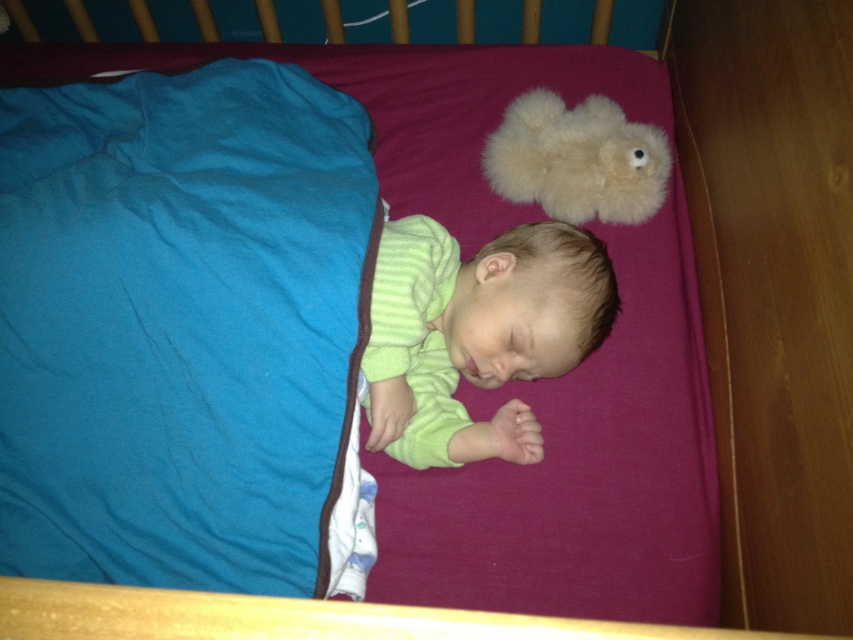
Based on the photo, you are a parent checking on your baby in the crib. You notice the teal soft fabric at lower left and the green soft baby at center. How far apart are these two items?

The teal soft fabric at lower left and the green soft baby at center are 8.13 inches apart from each other.

You are a parent checking on your baby in the crib. You notice the teal soft fabric at lower left and the fluffy beige teddy bear at upper center. Which object is taller?

The teal soft fabric at lower left is taller than the fluffy beige teddy bear at upper center.

You are a parent checking on your baby in the crib. You notice the teal soft fabric at lower left and the green soft baby at center. Which object is positioned higher in the crib?

The teal soft fabric at lower left is above the green soft baby at center, so it is positioned higher in the crib.